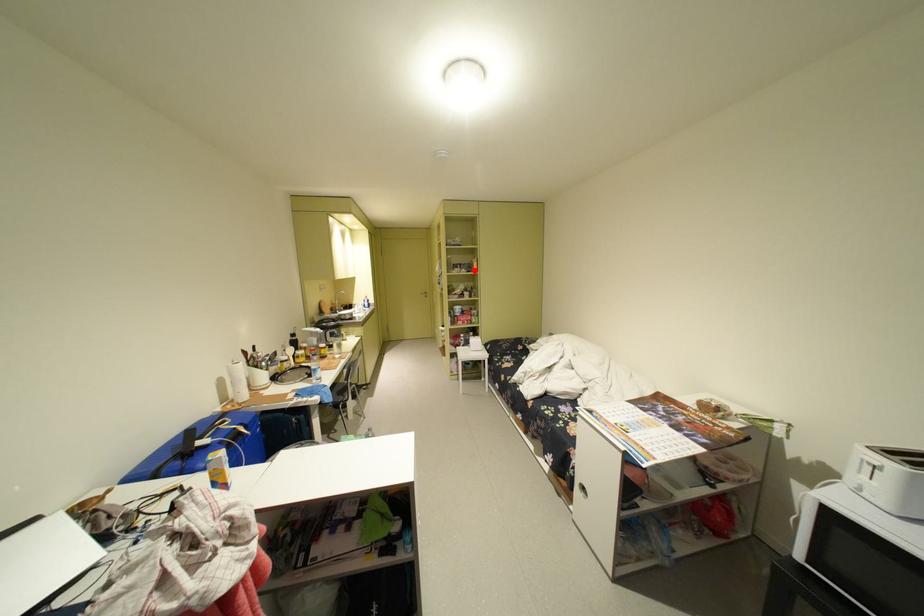
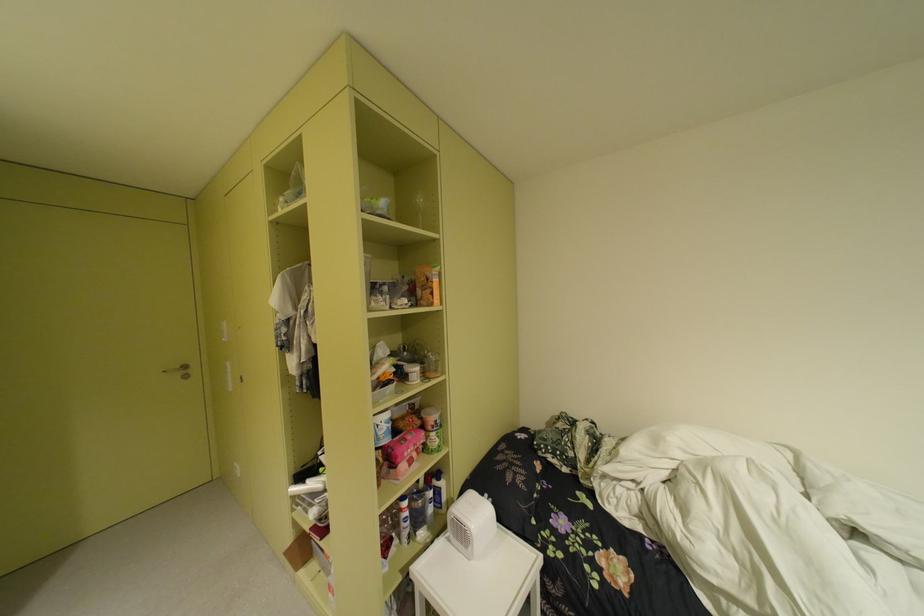
Question: I am providing you with two images of the same scene from different viewpoints. Given a red point in image1, look at the same physical point in image2. Is it:

Choices:
 (A) Closer to the viewpoint
 (B) Farther from the viewpoint

Answer: (B)